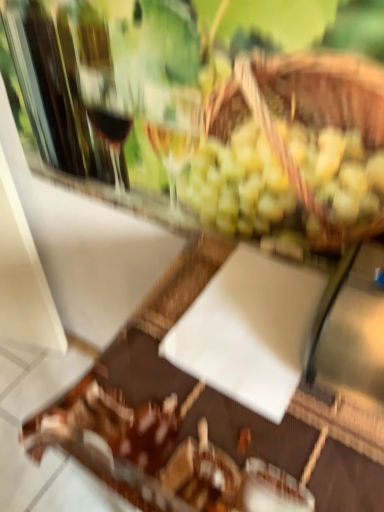
Question: Can you confirm if white matte cutting board at center is bigger than matte glass wine glass at upper center?

Choices:
 (A) yes
 (B) no

Answer: (A)

Question: Does white matte cutting board at center turn towards matte glass wine glass at upper center?

Choices:
 (A) yes
 (B) no

Answer: (B)

Question: Is white matte cutting board at center outside matte glass wine glass at upper center?

Choices:
 (A) no
 (B) yes

Answer: (B)

Question: Considering the relative positions of white matte cutting board at center and matte glass wine glass at upper center in the image provided, is white matte cutting board at center to the right of matte glass wine glass at upper center from the viewer's perspective?

Choices:
 (A) yes
 (B) no

Answer: (A)

Question: Does white matte cutting board at center have a greater width compared to matte glass wine glass at upper center?

Choices:
 (A) yes
 (B) no

Answer: (A)

Question: From the image's perspective, does white matte cutting board at center appear lower than matte glass wine glass at upper center?

Choices:
 (A) yes
 (B) no

Answer: (A)

Question: Considering the relative sizes of matte glass wine glass at upper center and white matte cutting board at center in the image provided, is matte glass wine glass at upper center smaller than white matte cutting board at center?

Choices:
 (A) no
 (B) yes

Answer: (B)

Question: Are matte glass wine glass at upper center and white matte cutting board at center far apart?

Choices:
 (A) yes
 (B) no

Answer: (B)

Question: Is white matte cutting board at center at the back of matte glass wine glass at upper center?

Choices:
 (A) no
 (B) yes

Answer: (A)

Question: Considering the relative positions of matte glass wine glass at upper center and white matte cutting board at center in the image provided, is matte glass wine glass at upper center behind white matte cutting board at center?

Choices:
 (A) no
 (B) yes

Answer: (B)

Question: Considering the relative sizes of matte glass wine glass at upper center and white matte cutting board at center in the image provided, is matte glass wine glass at upper center bigger than white matte cutting board at center?

Choices:
 (A) no
 (B) yes

Answer: (A)

Question: Can you confirm if matte glass wine glass at upper center is positioned to the right of white matte cutting board at center?

Choices:
 (A) no
 (B) yes

Answer: (A)

Question: In terms of height, does matte glass wine glass at upper center look taller or shorter compared to white matte cutting board at center?

Choices:
 (A) tall
 (B) short

Answer: (B)